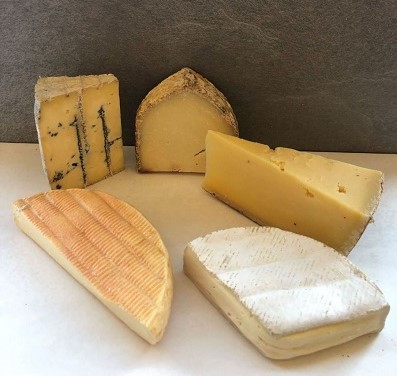
Where is `top left corner empty space`? top left corner empty space is located at coordinates (11, 8).